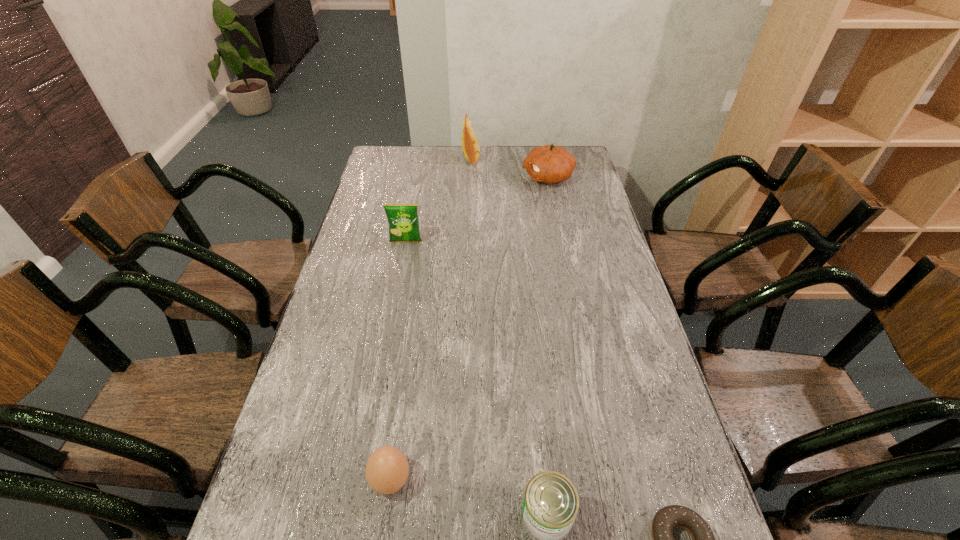
Identify the location of free space located 0.110m on the front-facing side of the nearer crisp (potato chip). (401, 268).

Where is `vacant area located 0.250m on the back of the boiled egg`? This screenshot has width=960, height=540. vacant area located 0.250m on the back of the boiled egg is located at coordinates (407, 366).

I want to click on crisp (potato chip) positioned at the far edge, so click(470, 145).

What are the coordinates of `pumpkin located at the far edge` in the screenshot? It's located at (550, 164).

Identify the location of object located at the left edge. The width and height of the screenshot is (960, 540). (403, 221).

This screenshot has height=540, width=960. Find the location of `object that is at the right edge`. object that is at the right edge is located at coordinates click(x=550, y=164).

Locate an element on the screen. object at the far right corner is located at coordinates (550, 164).

Identify the location of vacant area at the far edge. The height and width of the screenshot is (540, 960). (415, 163).

Identify the location of free location at the left edge. This screenshot has width=960, height=540. (361, 266).

Locate an element on the screen. free space at the right edge of the desktop is located at coordinates (627, 373).